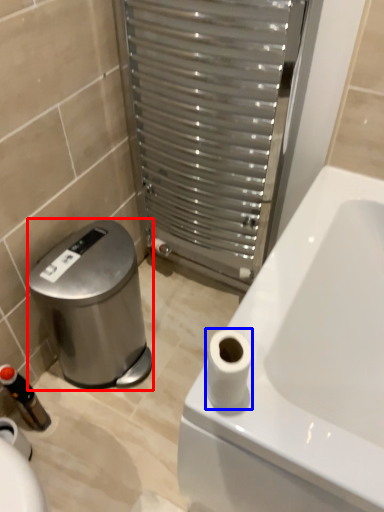
Question: Which point is further to the camera, water cooler (highlighted by a red box) or toilet paper (highlighted by a blue box)?

Choices:
 (A) water cooler
 (B) toilet paper

Answer: (A)